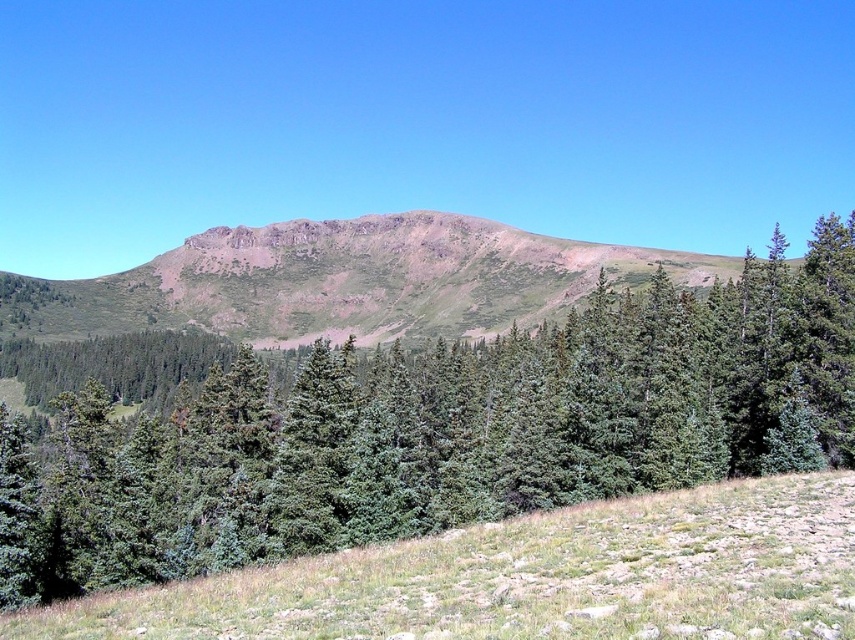
You are a hiker planning to climb the mountain. From your current position, which object is closer to you, the green matte tree at center or the rustic brown mountain at center?

The green matte tree at center is closer to you since it is positioned under the rustic brown mountain at center, meaning the tree is in front of the mountain in the scene.